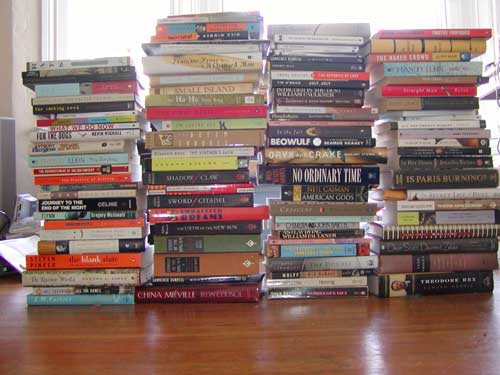
What are the coordinates of `books` in the screenshot? It's located at (215, 149), (320, 147), (434, 155), (109, 177).